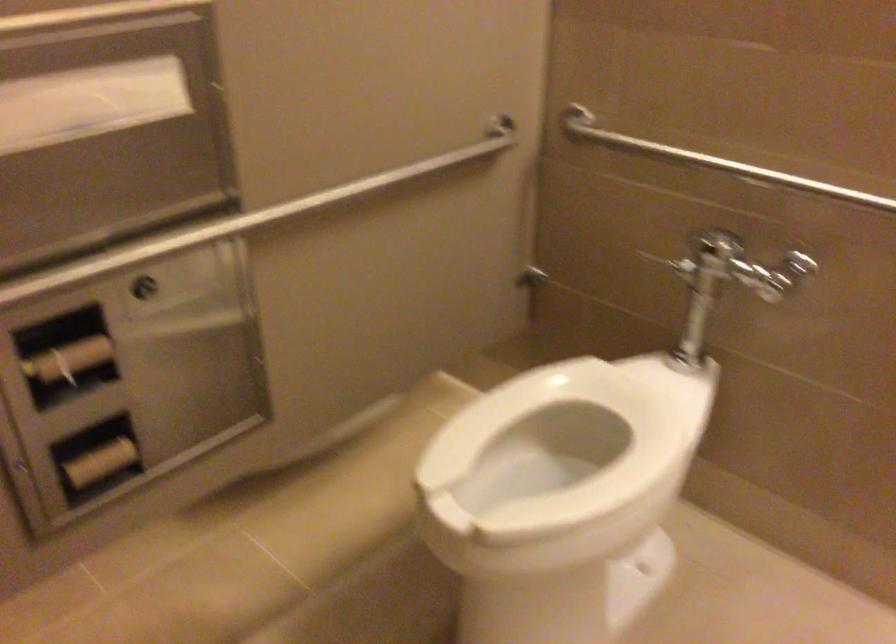
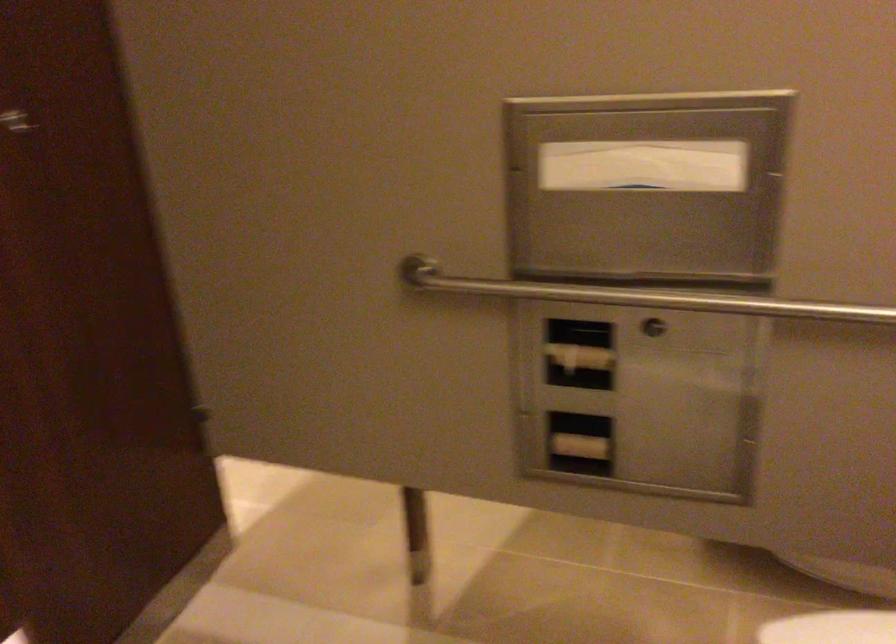
Where in the second image is the point corresponding to point (145, 252) from the first image?

(639, 296)